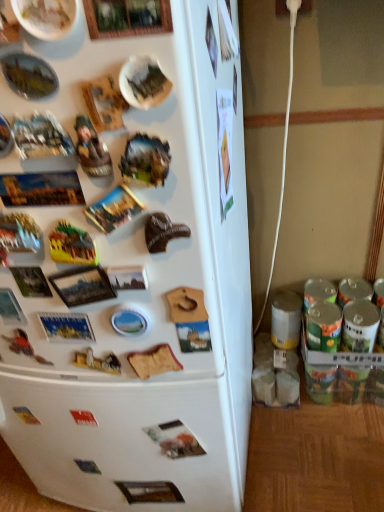
Question: From the image's perspective, is wooden figurine at upper left positioned above or below white matte refrigerator at left?

Choices:
 (A) below
 (B) above

Answer: (B)

Question: Is wooden figurine at upper left bigger or smaller than white matte refrigerator at left?

Choices:
 (A) small
 (B) big

Answer: (A)

Question: Is wooden figurine at upper left in front of or behind white matte refrigerator at left in the image?

Choices:
 (A) behind
 (B) front

Answer: (A)

Question: Based on their positions, is white matte refrigerator at left located to the left or right of wooden figurine at upper left?

Choices:
 (A) right
 (B) left

Answer: (B)

Question: Based on their sizes in the image, would you say white matte refrigerator at left is bigger or smaller than wooden figurine at upper left?

Choices:
 (A) big
 (B) small

Answer: (A)

Question: Is white matte refrigerator at left in front of or behind wooden figurine at upper left in the image?

Choices:
 (A) behind
 (B) front

Answer: (B)

Question: Would you say white matte refrigerator at left is inside or outside wooden figurine at upper left?

Choices:
 (A) outside
 (B) inside

Answer: (A)